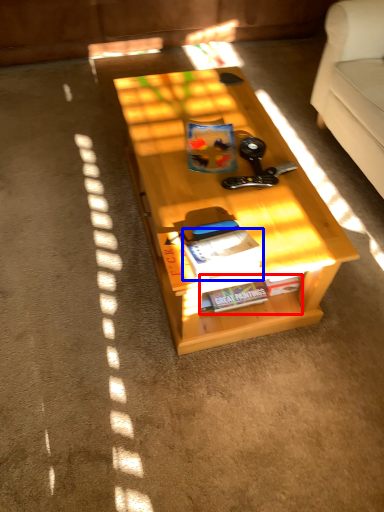
Question: Which object is closer to the camera taking this photo, book (highlighted by a red box) or magazine (highlighted by a blue box)?

Choices:
 (A) book
 (B) magazine

Answer: (B)